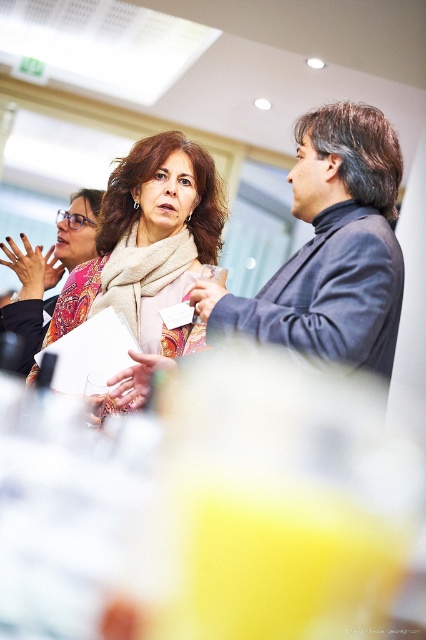
You are organizing a photo shoot and need to ensure that all scarves are visible in the frame. Given that the matte beige scarf at center and the matte pink scarf at center are both in the center, which one might be more likely to block the other from view?

The matte beige scarf at center is bigger than the matte pink scarf at center, so it might block the matte pink scarf at center from view.

You are a photographer at the event and want to take a photo of the dark blue sweater at center and the matte beige scarf at center. Which one should you focus on if you want the one on the left to be in focus?

The matte beige scarf at center is on the left side of the dark blue sweater at center, so you should focus on the matte beige scarf at center to have it in focus.